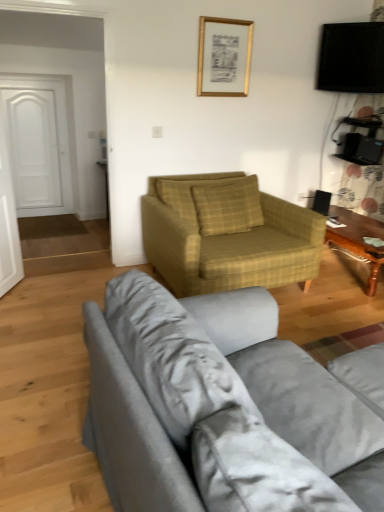
Where is `yellow plaid pillow at center`? Image resolution: width=384 pixels, height=512 pixels. yellow plaid pillow at center is located at coordinates (228, 206).

You are a GUI agent. You are given a task and a screenshot of the screen. Output one action in this format:
    pyautogui.click(x=<x>, y=<y>)
    Task: Click on the gold metallic picture frame at upper center
    The image size is (384, 512).
    Given the screenshot: What is the action you would take?
    pyautogui.click(x=224, y=57)

Measure the distance between yellow plaid fabric armchair at center and camera.

The depth of yellow plaid fabric armchair at center is 2.67 meters.

At what (x,y) coordinates should I click in order to perform the action: click on yellow plaid pillow at center. Please return your answer as a coordinate pair (x, y). This screenshot has width=384, height=512. Looking at the image, I should click on (228, 206).

Is black glossy tv at upper right not within yellow plaid pillow at center?

black glossy tv at upper right is positioned outside yellow plaid pillow at center.

From the image's perspective, would you say black glossy tv at upper right is shown under yellow plaid pillow at center?

No, from the image's perspective, black glossy tv at upper right is not below yellow plaid pillow at center.

Considering the relative sizes of black glossy tv at upper right and yellow plaid pillow at center in the image provided, is black glossy tv at upper right bigger than yellow plaid pillow at center?

No.

From a real-world perspective, is black glossy tv at upper right beneath yellow plaid pillow at center?

Incorrect, from a real-world perspective, black glossy tv at upper right is higher than yellow plaid pillow at center.

Does wooden polished coffee table at right contain yellow plaid pillow at center?

No, yellow plaid pillow at center is not a part of wooden polished coffee table at right.

Is wooden polished coffee table at right bigger than yellow plaid pillow at center?

Indeed, wooden polished coffee table at right has a larger size compared to yellow plaid pillow at center.

From a real-world perspective, who is located lower, wooden polished coffee table at right or yellow plaid pillow at center?

From a 3D spatial view, wooden polished coffee table at right is below.

Is wooden polished coffee table at right oriented away from yellow plaid pillow at center?

No.

How different are the orientations of wooden polished coffee table at right and black glossy tv at upper right in degrees?

There is a 37.3-degree angle between the facing directions of wooden polished coffee table at right and black glossy tv at upper right.

Is point (366, 230) closer or farther from the camera than point (351, 72)?

Point (366, 230) appears to be closer to the viewer than point (351, 72).

How far apart are wooden polished coffee table at right and black glossy tv at upper right?

The distance of wooden polished coffee table at right from black glossy tv at upper right is 4.27 feet.

From the picture: From the image's perspective, which one is positioned lower, wooden polished coffee table at right or black glossy tv at upper right?

wooden polished coffee table at right.

Considering the relative sizes of white matte door at left and wooden polished coffee table at right in the image provided, is white matte door at left thinner than wooden polished coffee table at right?

Correct, the width of white matte door at left is less than that of wooden polished coffee table at right.

Considering the sizes of objects white matte door at left and wooden polished coffee table at right in the image provided, who is taller, white matte door at left or wooden polished coffee table at right?

white matte door at left.

Considering the relative positions of white matte door at left and wooden polished coffee table at right in the image provided, is white matte door at left behind wooden polished coffee table at right?

Yes.

Which point is more distant from viewer, [19,105] or [352,250]?

The point [19,105] is more distant.

From a real-world perspective, between gold metallic picture frame at upper center and wooden polished coffee table at right, who is vertically lower?

wooden polished coffee table at right is physically lower.

Does gold metallic picture frame at upper center turn towards wooden polished coffee table at right?

No, gold metallic picture frame at upper center is not aimed at wooden polished coffee table at right.

Considering the sizes of objects gold metallic picture frame at upper center and wooden polished coffee table at right in the image provided, who is taller, gold metallic picture frame at upper center or wooden polished coffee table at right?

Standing taller between the two is gold metallic picture frame at upper center.

Between gold metallic picture frame at upper center and wooden polished coffee table at right, which one has larger size?

wooden polished coffee table at right is bigger.

Can you confirm if gray fabric couch at center is bigger than wooden polished coffee table at right?

Yes.

Is gray fabric couch at center positioned behind wooden polished coffee table at right?

No, it is in front of wooden polished coffee table at right.

Considering the relative positions of gray fabric couch at center and wooden polished coffee table at right in the image provided, is gray fabric couch at center to the left of wooden polished coffee table at right from the viewer's perspective?

Indeed, gray fabric couch at center is positioned on the left side of wooden polished coffee table at right.

Measure the distance from gray fabric couch at center to wooden polished coffee table at right.

gray fabric couch at center and wooden polished coffee table at right are 2.20 meters apart from each other.

Which object is closer to the camera, white matte door at left or yellow plaid pillow at center?

yellow plaid pillow at center is closer to the camera.

In the scene shown: From the image's perspective, is white matte door at left positioned above or below yellow plaid pillow at center?

white matte door at left is above yellow plaid pillow at center.

Looking at the image, does white matte door at left seem bigger or smaller compared to yellow plaid pillow at center?

Clearly, white matte door at left is larger in size than yellow plaid pillow at center.

Locate an element on the screen. television on the right of yellow plaid pillow at center is located at coordinates (351, 58).

The height and width of the screenshot is (512, 384). I want to click on pillow in front of the wooden polished coffee table at right, so click(228, 206).

Looking at the image, which one is located further to yellow plaid pillow at center, yellow plaid fabric armchair at center or white matte door at left?

white matte door at left is further to yellow plaid pillow at center.

From the image, which object appears to be nearer to gold metallic picture frame at upper center, white matte door at left or yellow plaid pillow at center?

yellow plaid pillow at center is closer to gold metallic picture frame at upper center.

Looking at this image, which object lies nearer to the anchor point wooden polished coffee table at right, gold metallic picture frame at upper center or yellow plaid pillow at center?

The object closer to wooden polished coffee table at right is yellow plaid pillow at center.

Based on their spatial positions, is yellow plaid pillow at center or yellow plaid fabric armchair at center further from white matte door at left?

The object further to white matte door at left is yellow plaid fabric armchair at center.

When comparing their distances from gray fabric couch at center, does white matte door at left or black glossy tv at upper right seem closer?

black glossy tv at upper right is closer to gray fabric couch at center.

Looking at the image, which one is located closer to yellow plaid pillow at center, white matte door at left or gold metallic picture frame at upper center?

gold metallic picture frame at upper center lies closer to yellow plaid pillow at center than the other object.

From the image, which object appears to be nearer to yellow plaid pillow at center, wooden polished coffee table at right or gold metallic picture frame at upper center?

wooden polished coffee table at right lies closer to yellow plaid pillow at center than the other object.

Considering their positions, is gray fabric couch at center positioned further to yellow plaid fabric armchair at center than black glossy tv at upper right?

Among the two, black glossy tv at upper right is located further to yellow plaid fabric armchair at center.

The width and height of the screenshot is (384, 512). Identify the location of pillow that lies between gold metallic picture frame at upper center and yellow plaid fabric armchair at center from top to bottom. (228, 206).

The width and height of the screenshot is (384, 512). I want to click on chair between yellow plaid pillow at center and wooden polished coffee table at right, so click(x=227, y=234).

What are the coordinates of `chair between gray fabric couch at center and yellow plaid pillow at center along the z-axis` in the screenshot? It's located at (227, 234).

The image size is (384, 512). Find the location of `picture frame between black glossy tv at upper right and wooden polished coffee table at right in the vertical direction`. picture frame between black glossy tv at upper right and wooden polished coffee table at right in the vertical direction is located at coordinates (224, 57).